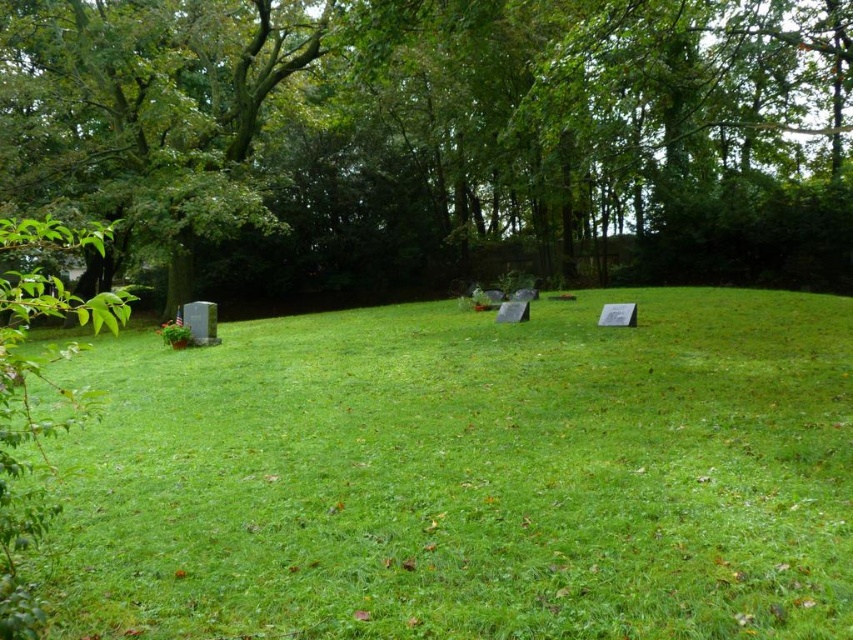
You are standing at the edge of the cemetery looking towards the center. You see the green grass at center and the green leafy tree at upper left. Which object is closer to you?

The green grass at center is closer to you because it is located below the green leafy tree at upper left, meaning the tree is further away in the background.

You are standing in the cemetery and want to take a photo that includes both the green grass at center and the green leafy tree at upper left. Which object will appear smaller in the photo?

The green grass at center will appear smaller in the photo because it occupies less space than the green leafy tree at upper left.

You are standing at the edge of the green field and want to walk towards the green leafy tree at upper left. As you walk, you notice the green grass at center. Which object will you encounter first?

You will encounter the green grass at center first because it is closer to you than the green leafy tree at upper left, which is further away.